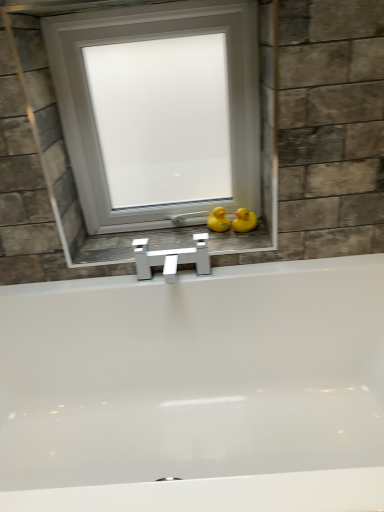
This screenshot has width=384, height=512. What are the coordinates of `space that is in front of yellow rubber duck at center, the first duck in the left-to-right sequence` in the screenshot? It's located at (221, 242).